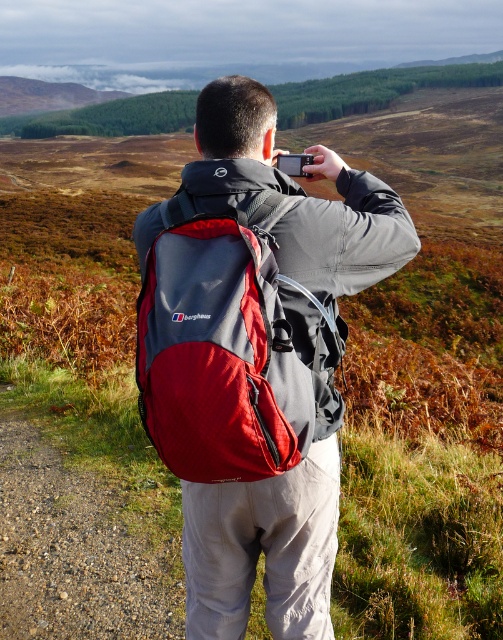
Question: Can you confirm if matte gray backpack at center is bigger than black plastic camera at upper center?

Choices:
 (A) yes
 (B) no

Answer: (A)

Question: Considering the real-world distances, which object is farthest from the red fabric backpack at back?

Choices:
 (A) matte gray backpack at center
 (B) black plastic camera at upper center

Answer: (B)

Question: Which of these objects is positioned farthest from the matte gray backpack at center?

Choices:
 (A) red fabric backpack at back
 (B) black plastic camera at upper center

Answer: (B)

Question: Does matte gray backpack at center appear on the right side of red fabric backpack at back?

Choices:
 (A) yes
 (B) no

Answer: (A)

Question: Can you confirm if matte gray backpack at center is positioned below black plastic camera at upper center?

Choices:
 (A) yes
 (B) no

Answer: (A)

Question: Which object is closer to the camera taking this photo?

Choices:
 (A) matte gray backpack at center
 (B) black plastic camera at upper center
 (C) red fabric backpack at back

Answer: (C)